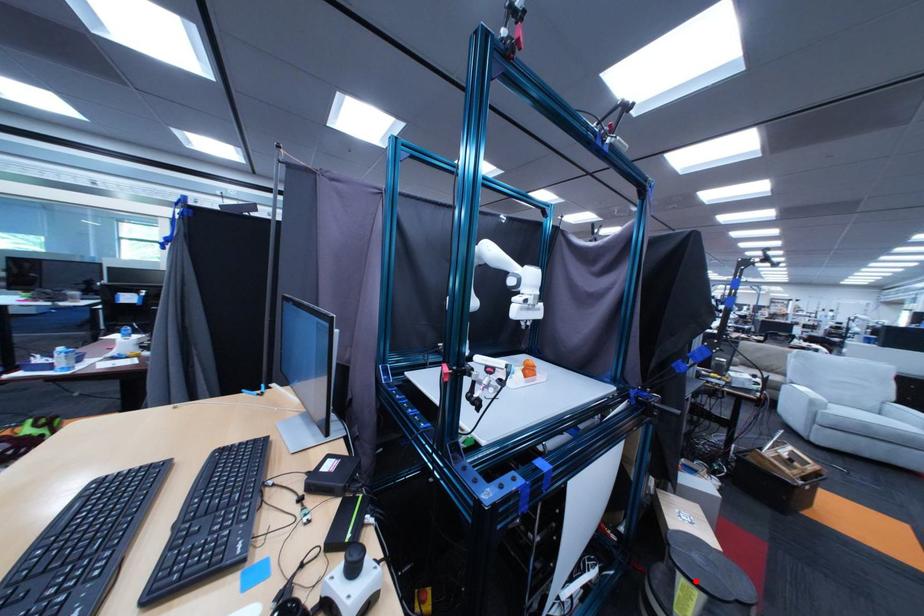
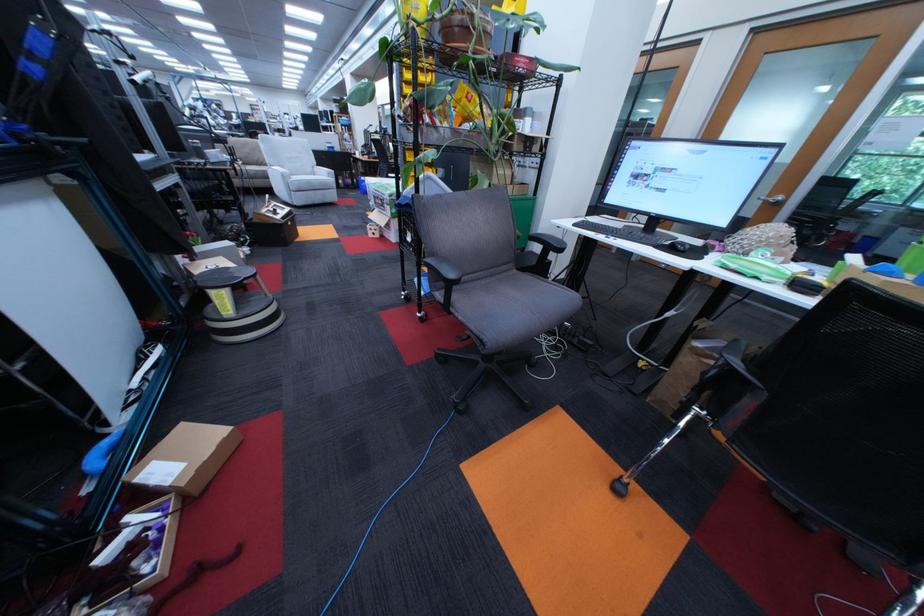
Question: I am providing you with two images of the same scene from different viewpoints. A red point is shown in image1. For the corresponding object point in image2, is it positioned nearer or farther from the camera?

Choices:
 (A) Nearer
 (B) Farther

Answer: (A)